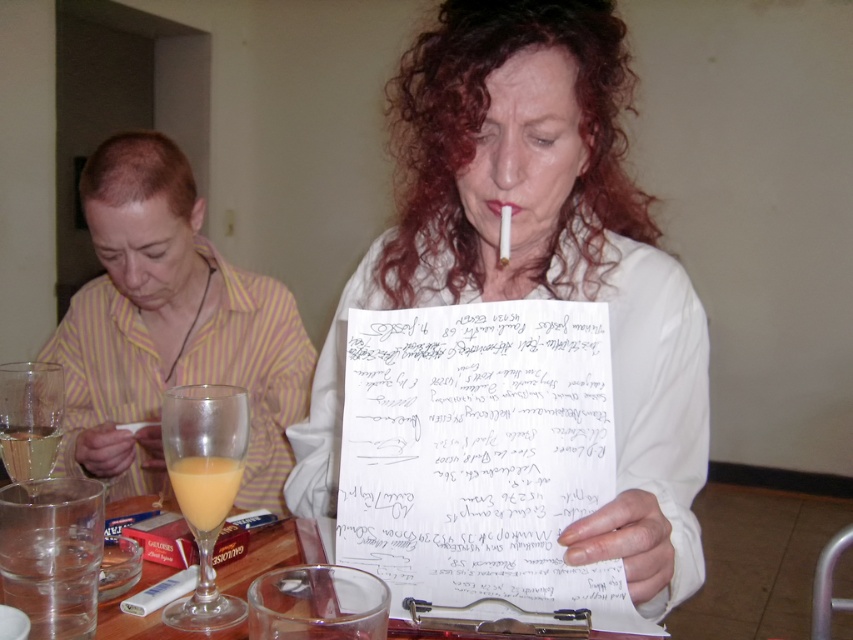
Question: Considering the real-world distances, which object is closest to the translucent glass at lower left?

Choices:
 (A) white paper at center
 (B) yellow striped shirt at left
 (C) clear glass at center
 (D) translucent glass at lower center

Answer: (C)

Question: Is the position of yellow striped shirt at left less distant than that of translucent glass at lower left?

Choices:
 (A) no
 (B) yes

Answer: (A)

Question: Which point is closer to the camera taking this photo?

Choices:
 (A) (241, 499)
 (B) (426, 150)

Answer: (B)

Question: Based on their relative distances, which object is nearer to the white paper at center?

Choices:
 (A) clear glass at center
 (B) translucent glass at lower center
 (C) translucent glass at lower left
 (D) yellow striped shirt at left

Answer: (A)

Question: From the image, what is the correct spatial relationship of clear glass at center in relation to translucent glass at lower left?

Choices:
 (A) left
 (B) right

Answer: (B)

Question: Is white paper at center positioned behind clear glass at center?

Choices:
 (A) yes
 (B) no

Answer: (B)